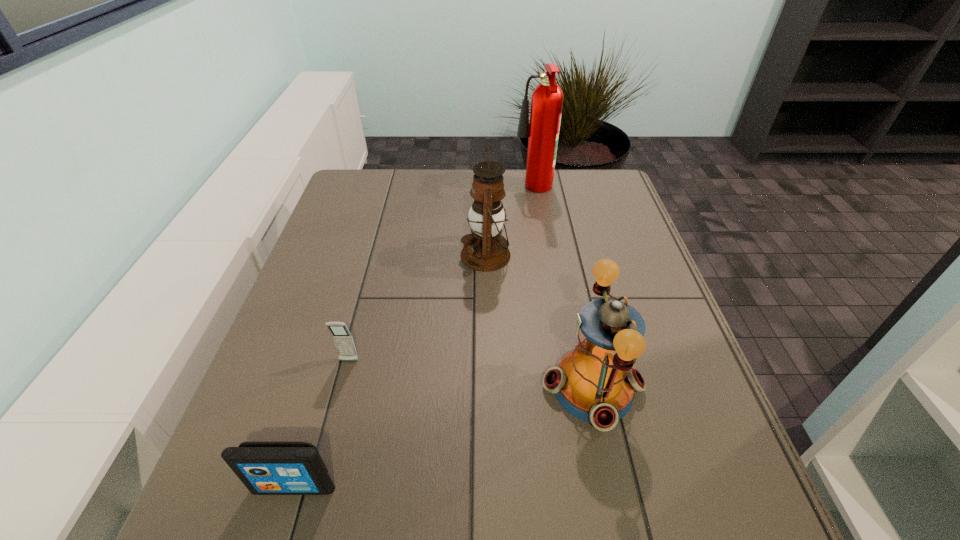
Where is `vacant space that's between the fire extinguisher and the third tallest object`? This screenshot has width=960, height=540. vacant space that's between the fire extinguisher and the third tallest object is located at coordinates (564, 289).

Identify the location of empty location between the second farthest object and the fire extinguisher. point(510,223).

At what (x,y) coordinates should I click in order to perform the action: click on object that can be found as the third closest to the cellular telephone. Please return your answer as a coordinate pair (x, y). The width and height of the screenshot is (960, 540). Looking at the image, I should click on (595, 383).

The height and width of the screenshot is (540, 960). What are the coordinates of `object that is the second closest to the cellular telephone` in the screenshot? It's located at (485, 250).

Image resolution: width=960 pixels, height=540 pixels. Find the location of `free space that satisfies the following two spatial constraints: 1. at the nozzle of the fire extinguisher; 2. on the front screen of the iPod`. free space that satisfies the following two spatial constraints: 1. at the nozzle of the fire extinguisher; 2. on the front screen of the iPod is located at coordinates (584, 487).

Find the location of `free location that satisfies the following two spatial constraints: 1. at the nozzle of the farthest object; 2. on the front screen of the iPod`. free location that satisfies the following two spatial constraints: 1. at the nozzle of the farthest object; 2. on the front screen of the iPod is located at coordinates (584, 487).

Where is `vacant space that satisfies the following two spatial constraints: 1. on the side of the left lantern, there is a wick adjustment knob; 2. on the front-facing side of the cellular telephone`? vacant space that satisfies the following two spatial constraints: 1. on the side of the left lantern, there is a wick adjustment knob; 2. on the front-facing side of the cellular telephone is located at coordinates (487, 361).

Locate an element on the screen. free space that satisfies the following two spatial constraints: 1. at the nozzle of the tallest object; 2. on the front screen of the iPod is located at coordinates (584, 487).

Identify the location of vacant region that satisfies the following two spatial constraints: 1. on the side of the second tallest object, there is a wick adjustment knob; 2. on the front screen of the nearest object. [489, 487].